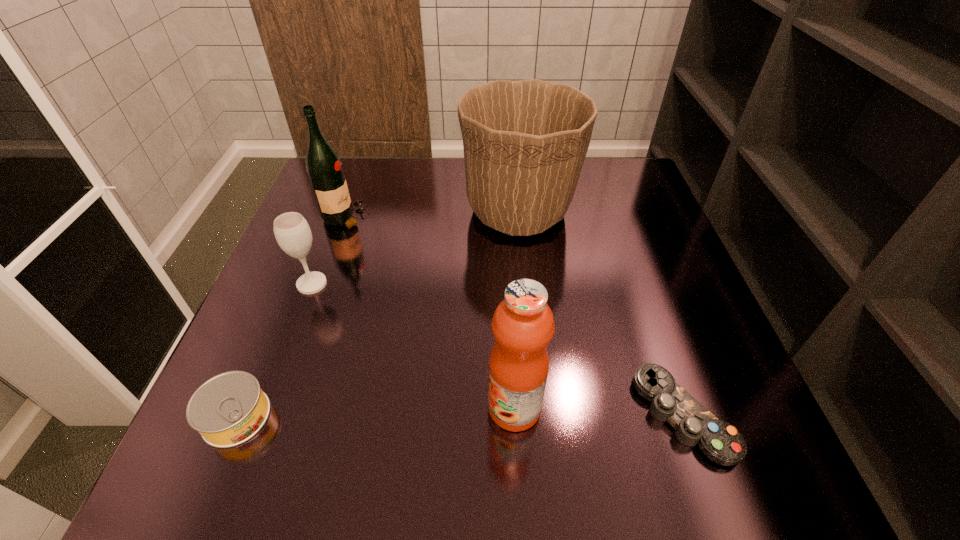
In order to click on free space located on the front label of the fruit juice in this screenshot , I will do `click(288, 408)`.

At what (x,y) coordinates should I click in order to perform the action: click on blank space located 0.280m on the front label of the fruit juice. Please return your answer as a coordinate pair (x, y). This screenshot has width=960, height=540. Looking at the image, I should click on (324, 408).

In order to click on vacant position located 0.100m on the front label of the fruit juice in this screenshot , I will do `click(429, 408)`.

This screenshot has height=540, width=960. I want to click on vacant region located 0.360m on the front of the third shortest object, so click(x=244, y=467).

The height and width of the screenshot is (540, 960). I want to click on vacant point located on the right of the can, so click(x=317, y=417).

The width and height of the screenshot is (960, 540). I want to click on free space located 0.130m on the left of the control, so click(x=563, y=415).

You are a GUI agent. You are given a task and a screenshot of the screen. Output one action in this format:
    pyautogui.click(x=<x>, y=<y>)
    Task: Click on the flowerpot present at the far edge
    
    Given the screenshot: What is the action you would take?
    pyautogui.click(x=525, y=142)

Where is `wine bottle at the far edge`? Image resolution: width=960 pixels, height=540 pixels. wine bottle at the far edge is located at coordinates (324, 168).

You are a GUI agent. You are given a task and a screenshot of the screen. Output one action in this format:
    pyautogui.click(x=<x>, y=<y>)
    Task: Click on the can at the near edge
    
    Given the screenshot: What is the action you would take?
    tap(230, 408)

Image resolution: width=960 pixels, height=540 pixels. In order to click on control located at the near edge in this screenshot , I will do `click(721, 442)`.